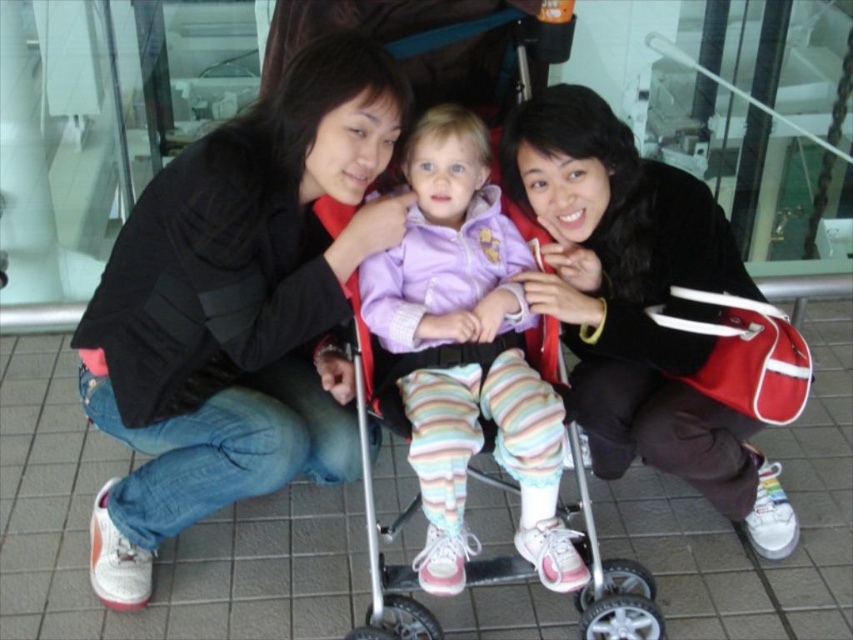
Between matte black jacket at center and black soft jacket at center, which one is positioned higher?

Positioned higher is matte black jacket at center.

Does matte black jacket at center appear over black soft jacket at center?

Yes, matte black jacket at center is above black soft jacket at center.

Locate an element on the screen. The height and width of the screenshot is (640, 853). matte black jacket at center is located at coordinates (236, 308).

Does point (340, 74) come farther from viewer compared to point (421, 461)?

Yes, point (340, 74) is behind point (421, 461).

Is point (271, 236) less distant than point (524, 388)?

No, (271, 236) is behind (524, 388).

Is point (154, 214) less distant than point (438, 490)?

That is False.

Identify the location of matte black jacket at center. (236, 308).

Does black soft jacket at center have a greater width compared to pastel striped leggings at center?

Indeed, black soft jacket at center has a greater width compared to pastel striped leggings at center.

Does point (749, 298) lie in front of point (508, 403)?

No, it is not.

Identify the location of black soft jacket at center. The image size is (853, 640). (656, 312).